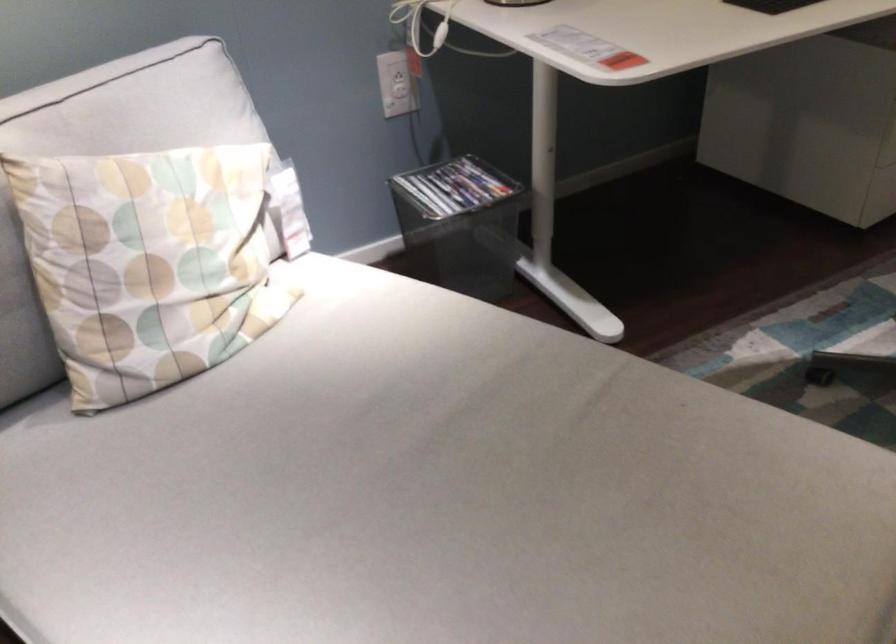
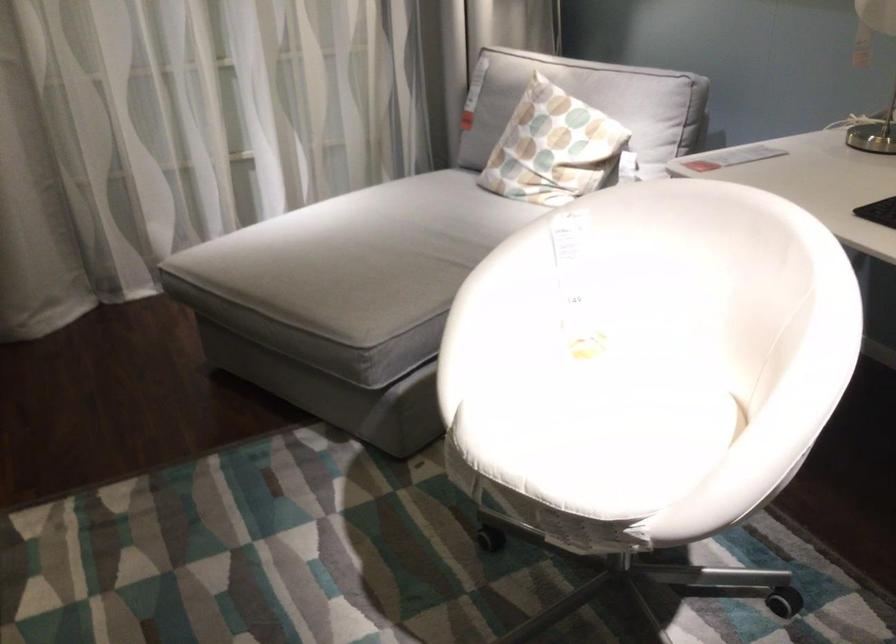
Find the pixel in the second image that matches pixel 197 245 in the first image.

(553, 147)